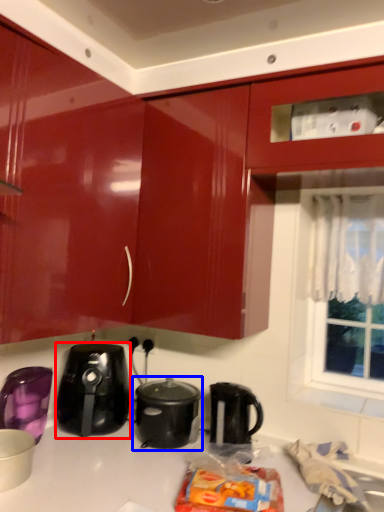
Question: Which object appears farthest to the camera in this image, home appliance (highlighted by a red box) or slow cooker (highlighted by a blue box)?

Choices:
 (A) home appliance
 (B) slow cooker

Answer: (A)